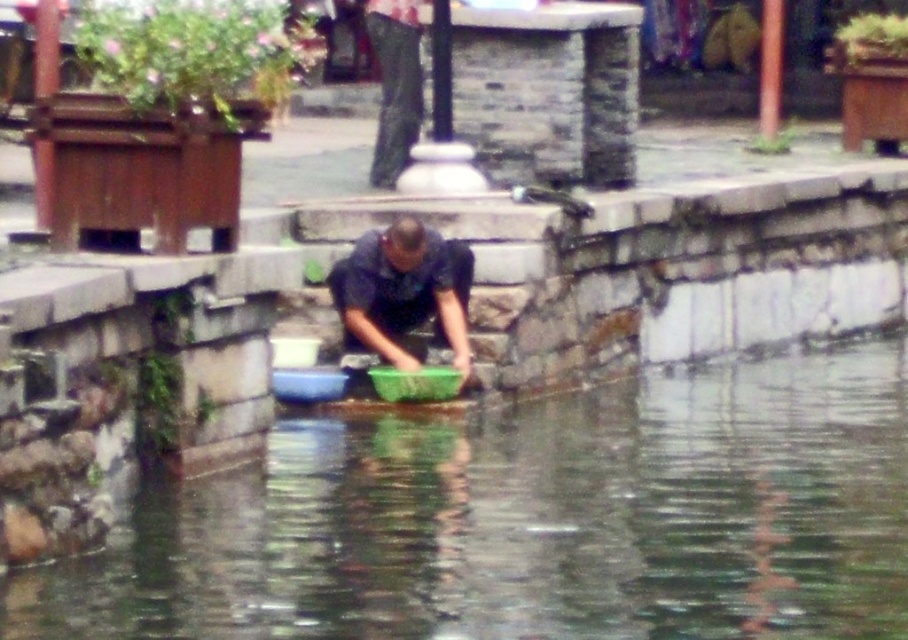
Is clear water at center below dark blue shirt at center?

Indeed, clear water at center is positioned under dark blue shirt at center.

Which is above, clear water at center or dark blue shirt at center?

dark blue shirt at center is higher up.

The image size is (908, 640). I want to click on clear water at center, so click(x=533, y=520).